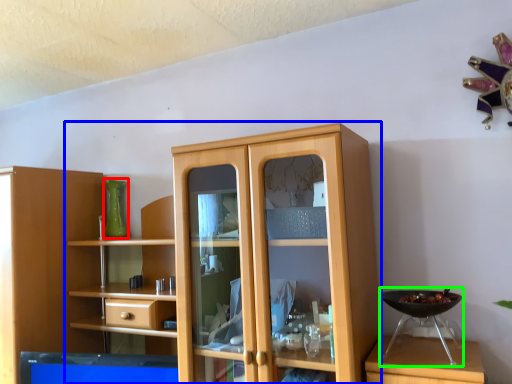
Question: Considering the real-world distances, which object is farthest from glass vase (highlighted by a red box)? cupboard (highlighted by a blue box) or appliance (highlighted by a green box)?

Choices:
 (A) cupboard
 (B) appliance

Answer: (B)